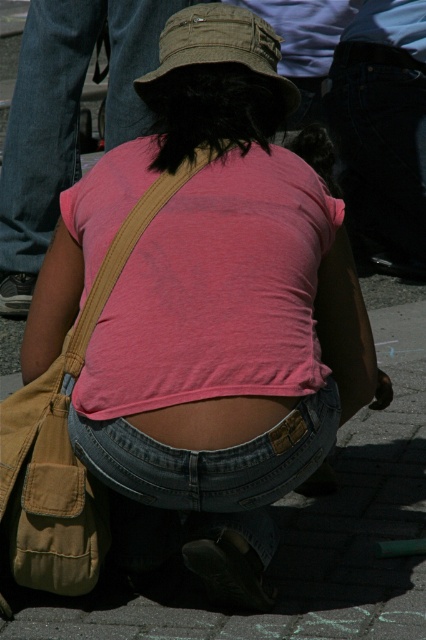
Question: Can you confirm if paved stone pavement at center is positioned to the right of khaki fabric hat at center?

Choices:
 (A) yes
 (B) no

Answer: (A)

Question: Can you confirm if paved stone pavement at center is smaller than matte pink skin at center?

Choices:
 (A) no
 (B) yes

Answer: (A)

Question: Which object appears farthest from the camera in this image?

Choices:
 (A) matte pink skin at center
 (B) jeans at center
 (C) khaki fabric hat at center

Answer: (B)

Question: Which point is farther to the camera?

Choices:
 (A) khaki fabric hat at center
 (B) denim at center

Answer: (A)

Question: Can you confirm if jeans at center is positioned above matte pink skin at center?

Choices:
 (A) no
 (B) yes

Answer: (B)

Question: Estimate the real-world distances between objects in this image. Which object is closer to the matte pink skin at center?

Choices:
 (A) jeans at center
 (B) khaki fabric hat at center
 (C) denim at center

Answer: (C)